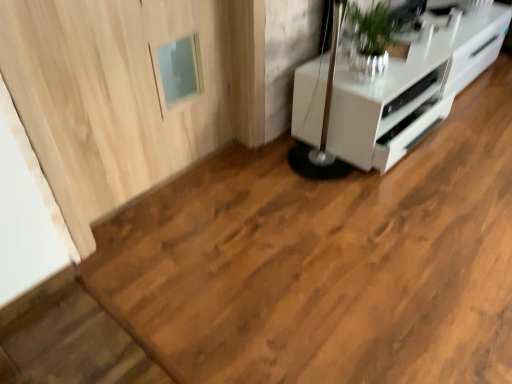
At what (x,y) coordinates should I click in order to perform the action: click on free location in front of white glossy cabinet at upper right. Please return your answer as a coordinate pair (x, y). Looking at the image, I should click on (404, 214).